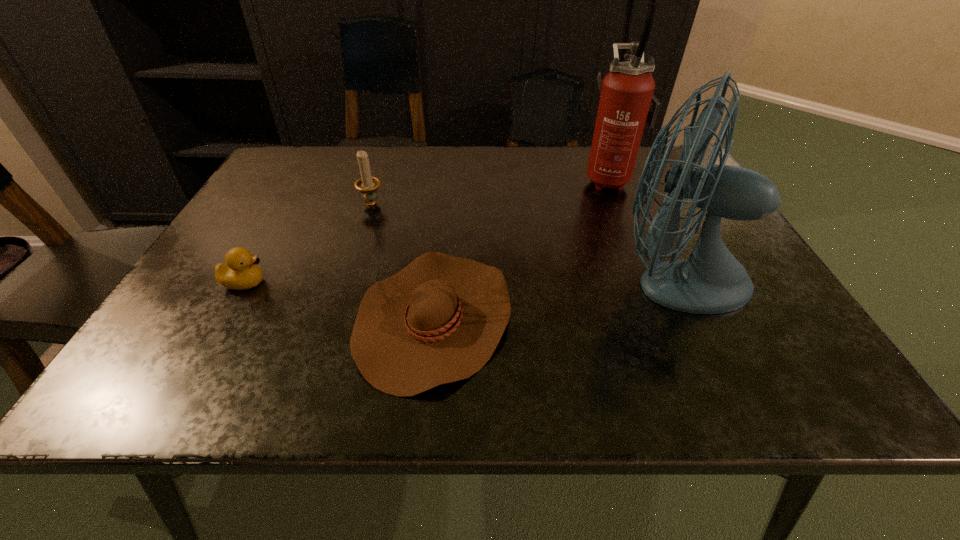
Where is `the tallest object`? This screenshot has height=540, width=960. the tallest object is located at coordinates (627, 101).

Locate an element on the screen. This screenshot has width=960, height=540. the farthest object is located at coordinates (627, 101).

This screenshot has height=540, width=960. I want to click on the second tallest object, so click(711, 281).

The width and height of the screenshot is (960, 540). What are the coordinates of `the fourth nearest object` in the screenshot? It's located at (367, 185).

Where is `the third tallest object`? This screenshot has width=960, height=540. the third tallest object is located at coordinates (367, 185).

Locate an element on the screen. The image size is (960, 540). the fourth tallest object is located at coordinates (241, 271).

Where is `the leftmost object`? the leftmost object is located at coordinates (241, 271).

At what (x,y) coordinates should I click in order to perform the action: click on cowboy hat. Please return your answer as a coordinate pair (x, y). Image resolution: width=960 pixels, height=540 pixels. Looking at the image, I should click on (439, 320).

At what (x,y) coordinates should I click in order to perform the action: click on the third object from left to right. Please return your answer as a coordinate pair (x, y). This screenshot has height=540, width=960. Looking at the image, I should click on (439, 320).

This screenshot has height=540, width=960. What are the coordinates of `free space located 0.180m at the nozzle of the farthest object` in the screenshot? It's located at (516, 178).